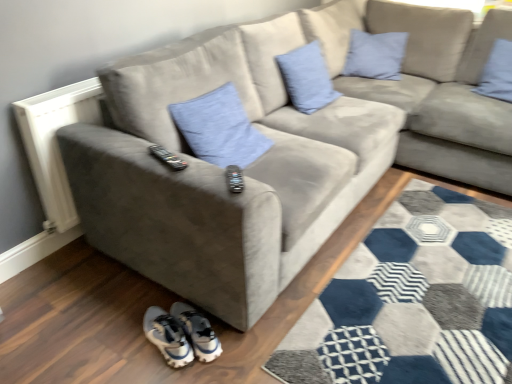
Question: From the image's perspective, is white synthetic sneakers at lower center below white textured radiator at left?

Choices:
 (A) no
 (B) yes

Answer: (B)

Question: Is white synthetic sneakers at lower center not inside white textured radiator at left?

Choices:
 (A) yes
 (B) no

Answer: (A)

Question: Is white synthetic sneakers at lower center oriented away from white textured radiator at left?

Choices:
 (A) yes
 (B) no

Answer: (B)

Question: From the image's perspective, is white synthetic sneakers at lower center above white textured radiator at left?

Choices:
 (A) no
 (B) yes

Answer: (A)

Question: From a real-world perspective, is white synthetic sneakers at lower center over white textured radiator at left?

Choices:
 (A) no
 (B) yes

Answer: (A)

Question: From a real-world perspective, is blue linen pillow at upper center, placed as the 3th pillow when sorted from right to left, physically located above or below blue fabric pillow at upper right, which is counted as the first pillow, starting from the right?

Choices:
 (A) above
 (B) below

Answer: (B)

Question: Based on their positions, is blue linen pillow at upper center, placed as the 3th pillow when sorted from right to left, located to the left or right of blue fabric pillow at upper right, the 4th pillow when ordered from left to right?

Choices:
 (A) left
 (B) right

Answer: (A)

Question: Is blue linen pillow at upper center, which ranks as the second pillow in left-to-right order, wider or thinner than blue fabric pillow at upper right, the 4th pillow when ordered from left to right?

Choices:
 (A) thin
 (B) wide

Answer: (B)

Question: Is point (293, 84) closer or farther from the camera than point (502, 87)?

Choices:
 (A) closer
 (B) farther

Answer: (A)

Question: Considering the positions of point (73, 117) and point (337, 92), is point (73, 117) closer or farther from the camera than point (337, 92)?

Choices:
 (A) closer
 (B) farther

Answer: (A)

Question: From a real-world perspective, is white textured radiator at left above or below blue linen pillow at upper center, placed as the 3th pillow when sorted from right to left?

Choices:
 (A) above
 (B) below

Answer: (B)

Question: Do you think white textured radiator at left is within blue linen pillow at upper center, which ranks as the second pillow in left-to-right order, or outside of it?

Choices:
 (A) inside
 (B) outside

Answer: (B)

Question: Is white textured radiator at left to the left or to the right of blue linen pillow at upper center, which ranks as the second pillow in left-to-right order, in the image?

Choices:
 (A) right
 (B) left

Answer: (B)

Question: In the image, is blue fabric pillow at upper right, which is counted as the first pillow, starting from the right, on the left side or the right side of blue linen pillow at upper center, placed as the 3th pillow when sorted from right to left?

Choices:
 (A) left
 (B) right

Answer: (B)

Question: Considering the positions of blue fabric pillow at upper right, the 4th pillow when ordered from left to right, and blue linen pillow at upper center, which ranks as the second pillow in left-to-right order, in the image, is blue fabric pillow at upper right, the 4th pillow when ordered from left to right, bigger or smaller than blue linen pillow at upper center, which ranks as the second pillow in left-to-right order,?

Choices:
 (A) small
 (B) big

Answer: (A)